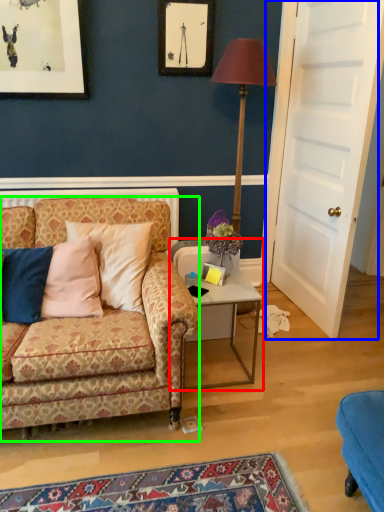
Question: Based on their relative distances, which object is nearer to table (highlighted by a red box)? Choose from door (highlighted by a blue box) and studio couch (highlighted by a green box).

Choices:
 (A) door
 (B) studio couch

Answer: (B)